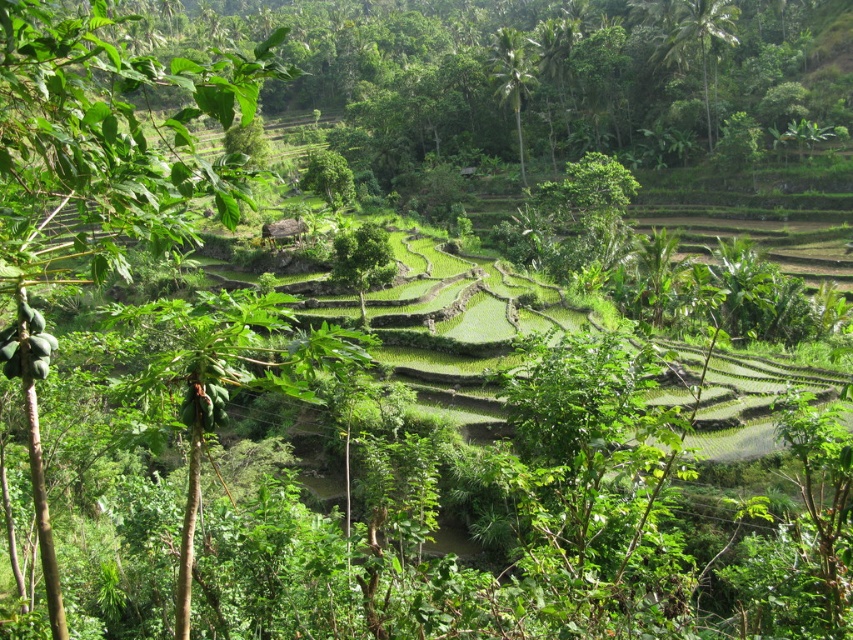
Question: Does green leafy tree at center have a lesser width compared to green leafy palm at upper center?

Choices:
 (A) yes
 (B) no

Answer: (A)

Question: Is green leafy tree at upper right in front of green leafy palm at upper center?

Choices:
 (A) yes
 (B) no

Answer: (B)

Question: Which point is closer to the camera?

Choices:
 (A) green leafy tree at center
 (B) green leafy tree at upper right
 (C) green leafy palm at upper center

Answer: (A)

Question: Estimate the real-world distances between objects in this image. Which object is closer to the green leafy palm at upper center?

Choices:
 (A) green leafy tree at center
 (B) green leafy tree at upper right

Answer: (B)

Question: From the image, what is the correct spatial relationship of green leafy tree at upper right in relation to green leafy palm at upper center?

Choices:
 (A) above
 (B) below

Answer: (A)

Question: Among these objects, which one is nearest to the camera?

Choices:
 (A) green leafy tree at upper right
 (B) green leafy palm at upper center
 (C) green leafy tree at center

Answer: (C)